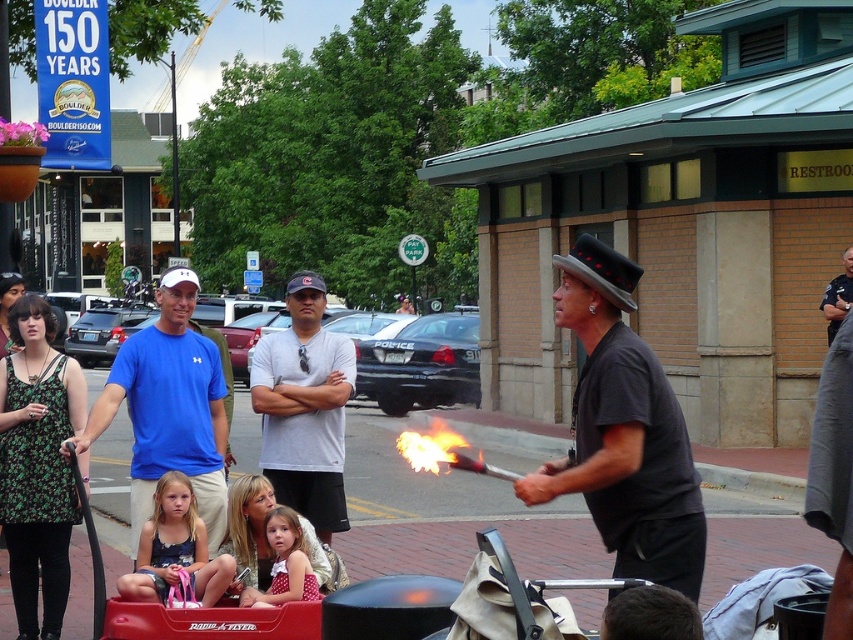
You are a photographer at the event and want to capture both the blue cotton shirt at center and the matte blue dress at center in a single frame. Which one should you focus on first to ensure they are both in the frame?

The blue cotton shirt at center is much taller than the matte blue dress at center, so you should focus on the blue cotton shirt at center first to ensure both are in the frame.

You are a photographer at the event and want to capture both the blue cotton shirt at center and the matte blue dress at center in a single frame. Which one should you position on the left side of your photo?

You should position the blue cotton shirt at center on the left side of your photo because it is already to the left of the matte blue dress at center in the scene.

You are a photographer at the event and want to capture the matte blue dress at center without the flameliquidfire at center obstructing it. How should you adjust your camera angle?

The matte blue dress at center is positioned under the flameliquidfire at center. To avoid obstruction, you should angle your camera downward to focus on the dress while positioning the flame above it out of the frame.